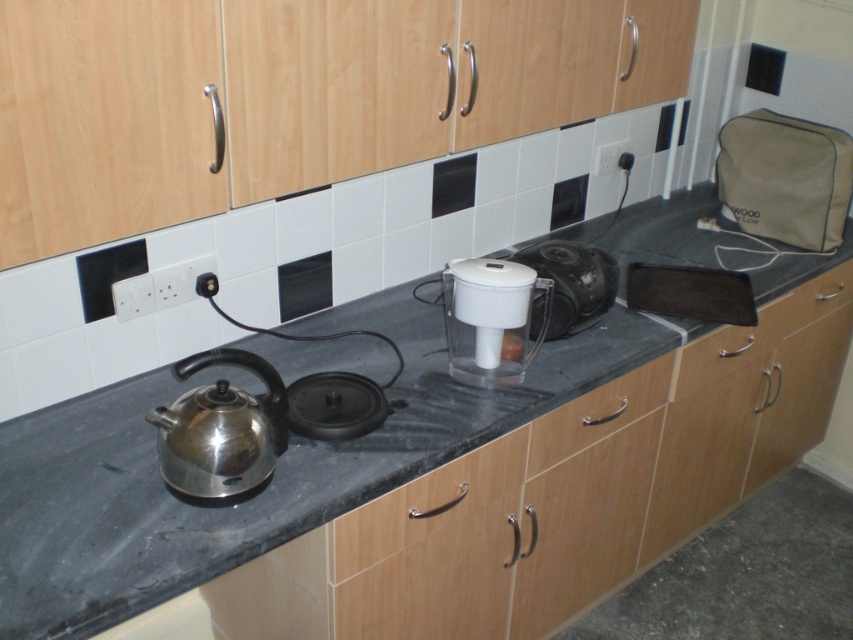
Question: Which of the following is the farthest from the observer?

Choices:
 (A) (241, 410)
 (B) (596, 285)

Answer: (B)

Question: Among these points, which one is farthest from the camera?

Choices:
 (A) (642, 378)
 (B) (788, 296)

Answer: (B)

Question: From the image, what is the correct spatial relationship of black granite countertop at center in relation to white plastic toaster at center?

Choices:
 (A) left
 (B) right

Answer: (A)

Question: Does wooden drawer at lower right have a greater width compared to white plastic toaster at center?

Choices:
 (A) no
 (B) yes

Answer: (B)

Question: Which object is closer to the camera taking this photo?

Choices:
 (A) white plastic toaster at center
 (B) wooden drawer at lower right

Answer: (A)

Question: Does stainless steel kettle at left appear on the left side of white plastic water filter at center?

Choices:
 (A) yes
 (B) no

Answer: (A)